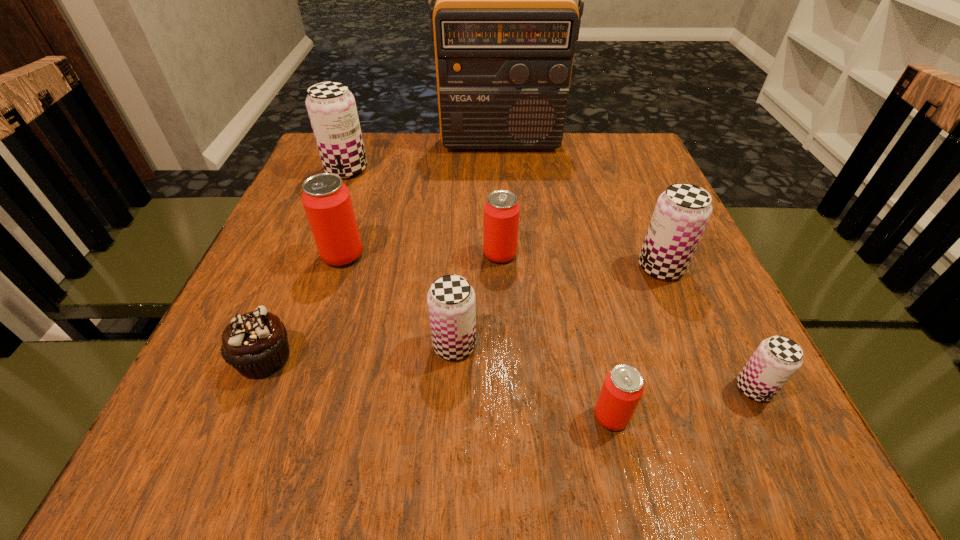
Locate an element on the screen. vacant space that is in between the brown cupcake and the fourth beer can from right to left is located at coordinates [x=382, y=307].

Where is `vacant space that is in between the tallest beer can and the second red beer can from left to right`? The height and width of the screenshot is (540, 960). vacant space that is in between the tallest beer can and the second red beer can from left to right is located at coordinates (423, 212).

Locate an element on the screen. object that can be found as the eighth closest to the brown cupcake is located at coordinates (776, 360).

Locate which object is the seventh closest to the nearest red beer can. Please provide its 2D coordinates. Your answer should be formatted as a tuple, i.e. [(x, y)], where the tuple contains the x and y coordinates of a point satisfying the conditions above.

[(504, 26)]

Identify which beer can is the sixth nearest to the nearest red beer can. Please provide its 2D coordinates. Your answer should be formatted as a tuple, i.e. [(x, y)], where the tuple contains the x and y coordinates of a point satisfying the conditions above.

[(331, 107)]

Identify which beer can is located as the third nearest to the biggest red beer can. Please provide its 2D coordinates. Your answer should be formatted as a tuple, i.e. [(x, y)], where the tuple contains the x and y coordinates of a point satisfying the conditions above.

[(501, 211)]

Image resolution: width=960 pixels, height=540 pixels. In order to click on purple beer can that is the fourth closest one to the biggest red beer can in this screenshot , I will do `click(776, 360)`.

Identify which purple beer can is located as the second nearest to the fourth beer can from left to right. Please provide its 2D coordinates. Your answer should be formatted as a tuple, i.e. [(x, y)], where the tuple contains the x and y coordinates of a point satisfying the conditions above.

[(681, 214)]

Locate an element on the screen. red beer can object that ranks as the second closest to the second smallest red beer can is located at coordinates click(x=623, y=387).

The width and height of the screenshot is (960, 540). Find the location of `red beer can identified as the closest to the rightmost red beer can`. red beer can identified as the closest to the rightmost red beer can is located at coordinates (501, 211).